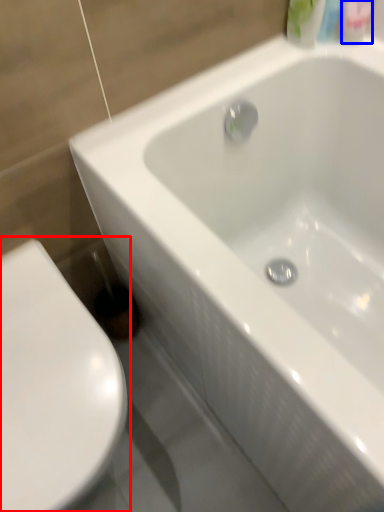
Question: Which object appears farthest to the camera in this image, toilet (highlighted by a red box) or mouthwash (highlighted by a blue box)?

Choices:
 (A) toilet
 (B) mouthwash

Answer: (B)